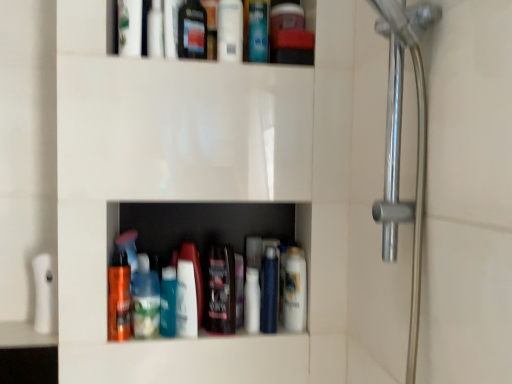
How much space does glossy plastic mouthwash at upper center, the third mouthwash when ordered from left to right, occupy horizontally?

2.19 inches.

The width and height of the screenshot is (512, 384). What are the coordinates of `green glossy mouthwash at upper center, which is counted as the third mouthwash, starting from the right` in the screenshot? It's located at (258, 31).

This screenshot has height=384, width=512. What do you see at coordinates (400, 144) in the screenshot? I see `silver metallic shower handle at right` at bounding box center [400, 144].

Find the location of a particular element. translucent plastic bottles at center is located at coordinates (204, 226).

What do you see at coordinates (204, 226) in the screenshot? I see `translucent plastic bottles at center` at bounding box center [204, 226].

Consider the image. What is the approximate width of white glossy lotion at center, which appears as the 1th toiletry when ordered from the bottom?

white glossy lotion at center, which appears as the 1th toiletry when ordered from the bottom, is 2.79 inches wide.

The width and height of the screenshot is (512, 384). I want to click on glossy plastic mouthwash at upper center, the third mouthwash when ordered from left to right, so click(x=192, y=30).

Which object is further away from the camera, white glossy lotion at center, which appears as the 1th toiletry when ordered from the bottom, or translucent plastic bottles at center?

translucent plastic bottles at center is further from the camera.

Is white glossy lotion at center, which appears as the 1th toiletry when ordered from the bottom, beside translucent plastic bottles at center?

No, white glossy lotion at center, which appears as the 1th toiletry when ordered from the bottom, is not touching translucent plastic bottles at center.

Can you confirm if white glossy lotion at center, the 2th toiletry viewed from the top, is bigger than translucent plastic bottles at center?

Actually, white glossy lotion at center, the 2th toiletry viewed from the top, might be smaller than translucent plastic bottles at center.

Between white glossy lotion at center, acting as the second toiletry starting from the left, and translucent plastic bottles at center, which one has more height?

translucent plastic bottles at center is taller.

Is white glossy mouthwash at upper center, which appears as the fifth mouthwash when viewed from the left, inside or outside of glossy plastic mouthwash at upper center, the third mouthwash when ordered from left to right?

The correct answer is: outside.

Between white glossy mouthwash at upper center, the fourth mouthwash in the right-to-left sequence, and glossy plastic mouthwash at upper center, which appears as the sixth mouthwash when viewed from the right, which one has larger width?

Wider between the two is white glossy mouthwash at upper center, the fourth mouthwash in the right-to-left sequence.

From the picture: Can you confirm if white glossy mouthwash at upper center, the fourth mouthwash in the right-to-left sequence, is smaller than glossy plastic mouthwash at upper center, which appears as the sixth mouthwash when viewed from the right?

Yes.

Is green glossy mouthwash at upper center, the 6th mouthwash when ordered from left to right, not close to glossy plastic mouthwash at upper center, the third mouthwash when ordered from left to right?

No, green glossy mouthwash at upper center, the 6th mouthwash when ordered from left to right, is not far away from glossy plastic mouthwash at upper center, the third mouthwash when ordered from left to right.

Is green glossy mouthwash at upper center, which is counted as the third mouthwash, starting from the right, not within glossy plastic mouthwash at upper center, which appears as the sixth mouthwash when viewed from the right?

Absolutely, green glossy mouthwash at upper center, which is counted as the third mouthwash, starting from the right, is external to glossy plastic mouthwash at upper center, which appears as the sixth mouthwash when viewed from the right.

From the glossy plastic mouthwash at upper center, which appears as the sixth mouthwash when viewed from the right, count 2nd mouthwashs backward and point to it. Please provide its 2D coordinates.

[(258, 31)]

Locate an element on the screen. The width and height of the screenshot is (512, 384). the 3rd mouthwash below the shiny black bottle at center, which ranks as the 4th mouthwash in left-to-right order (from a real-world perspective) is located at coordinates (119, 296).

Is point (212, 285) closer to camera compared to point (117, 259)?

Yes.

From a real-world perspective, is shiny black bottle at center, placed as the fifth mouthwash when sorted from right to left, physically located above or below shiny orange bottle at lower center, which is counted as the 1th mouthwash, starting from the left?

shiny black bottle at center, placed as the fifth mouthwash when sorted from right to left, is above shiny orange bottle at lower center, which is counted as the 1th mouthwash, starting from the left.

Is shiny black bottle at center, placed as the fifth mouthwash when sorted from right to left, not inside shiny orange bottle at lower center, which is counted as the 1th mouthwash, starting from the left?

shiny black bottle at center, placed as the fifth mouthwash when sorted from right to left, is positioned outside shiny orange bottle at lower center, which is counted as the 1th mouthwash, starting from the left.

Does silver metallic shower handle at right appear on the left side of glossy plastic mouthwash at upper center, the third mouthwash when ordered from left to right?

In fact, silver metallic shower handle at right is to the right of glossy plastic mouthwash at upper center, the third mouthwash when ordered from left to right.

Can you confirm if silver metallic shower handle at right is taller than glossy plastic mouthwash at upper center, the third mouthwash when ordered from left to right?

Yes.

Does point (397, 139) come farther from viewer compared to point (201, 14)?

No, it is in front of (201, 14).

From the image's perspective, who appears lower, glossy plastic mouthwash at upper center, the third mouthwash when ordered from left to right, or white glossy lotion at center, which is the first toiletry from right to left?

white glossy lotion at center, which is the first toiletry from right to left, appears lower in the image.

Is glossy plastic mouthwash at upper center, the third mouthwash when ordered from left to right, surrounding white glossy lotion at center, which is the first toiletry from right to left?

No, glossy plastic mouthwash at upper center, the third mouthwash when ordered from left to right, does not contain white glossy lotion at center, which is the first toiletry from right to left.

Identify the location of toiletry that is the 2nd one below the glossy plastic mouthwash at upper center, which appears as the sixth mouthwash when viewed from the right (from a real-world perspective). (189, 291).

Does glossy plastic mouthwash at upper center, which appears as the sixth mouthwash when viewed from the right, have a smaller size compared to white glossy lotion at center, acting as the second toiletry starting from the left?

No, glossy plastic mouthwash at upper center, which appears as the sixth mouthwash when viewed from the right, is not smaller than white glossy lotion at center, acting as the second toiletry starting from the left.

Which object is positioned more to the right, translucent plastic mouthwash at lower center, which appears as the 2th mouthwash when viewed from the left, or white glossy lotion at center, the 2th toiletry viewed from the top?

Positioned to the right is white glossy lotion at center, the 2th toiletry viewed from the top.

From the image's perspective, which one is positioned higher, translucent plastic mouthwash at lower center, which appears as the 2th mouthwash when viewed from the left, or white glossy lotion at center, the 2th toiletry viewed from the top?

white glossy lotion at center, the 2th toiletry viewed from the top, appears higher in the image.

Where is `mouthwash that is the 2nd object located below the white glossy lotion at center, which appears as the 1th toiletry when ordered from the bottom (from the image's perspective)`? This screenshot has width=512, height=384. mouthwash that is the 2nd object located below the white glossy lotion at center, which appears as the 1th toiletry when ordered from the bottom (from the image's perspective) is located at coordinates point(145,299).

Considering the relative sizes of translucent plastic mouthwash at lower center, which appears as the 2th mouthwash when viewed from the left, and white glossy lotion at center, which appears as the 1th toiletry when ordered from the bottom, in the image provided, is translucent plastic mouthwash at lower center, which appears as the 2th mouthwash when viewed from the left, shorter than white glossy lotion at center, which appears as the 1th toiletry when ordered from the bottom,?

Indeed, translucent plastic mouthwash at lower center, which appears as the 2th mouthwash when viewed from the left, has a lesser height compared to white glossy lotion at center, which appears as the 1th toiletry when ordered from the bottom.

Identify the location of shelf behind the white glossy lotion at center, the 2th toiletry viewed from the top. This screenshot has height=384, width=512. (204, 226).

From a real-world perspective, which mouthwash is the 1st one underneath the white glossy mouthwash at upper center, the fourth mouthwash in the right-to-left sequence? Please provide its 2D coordinates.

[(192, 30)]

When comparing their distances from shiny black bottle at center, which ranks as the 4th mouthwash in left-to-right order, does silver metallic shower handle at right or translucent plastic bottle at center seem closer?

Among the two, translucent plastic bottle at center is located nearer to shiny black bottle at center, which ranks as the 4th mouthwash in left-to-right order.

Considering their positions, is shiny black bottle at center, placed as the fifth mouthwash when sorted from right to left, positioned closer to translucent plastic mouthwash at lower center, the seventh mouthwash from the right, than white glossy mouthwash at center, which is counted as the eighth mouthwash, starting from the left?

The object closer to translucent plastic mouthwash at lower center, the seventh mouthwash from the right, is shiny black bottle at center, placed as the fifth mouthwash when sorted from right to left.

Considering their positions, is shiny orange bottle at lower center, which is counted as the 1th mouthwash, starting from the left, positioned closer to translucent plastic mouthwash at lower center, the seventh mouthwash from the right, than blue glossy mouthwash at center, positioned as the 7th mouthwash in left-to-right order?

shiny orange bottle at lower center, which is counted as the 1th mouthwash, starting from the left, is positioned closer to the anchor translucent plastic mouthwash at lower center, the seventh mouthwash from the right.

Looking at the image, which one is located further to translucent plastic mouthwash at lower center, which appears as the 2th mouthwash when viewed from the left, glossy plastic mouthwash at upper center, the third mouthwash when ordered from left to right, or shiny black bottle at center, which ranks as the 4th mouthwash in left-to-right order?

glossy plastic mouthwash at upper center, the third mouthwash when ordered from left to right, is further to translucent plastic mouthwash at lower center, which appears as the 2th mouthwash when viewed from the left.

Estimate the real-world distances between objects in this image. Which object is closer to blue glossy mouthwash at center, the 2th mouthwash viewed from the right, shiny black bottle at center, which ranks as the 4th mouthwash in left-to-right order, or translucent plastic bottle at center?

shiny black bottle at center, which ranks as the 4th mouthwash in left-to-right order, is positioned closer to the anchor blue glossy mouthwash at center, the 2th mouthwash viewed from the right.

Looking at the image, which one is located further to silver metallic shower handle at right, shiny orange bottle at lower center, which is counted as the 1th mouthwash, starting from the left, or translucent plastic bottles at center?

Among the two, shiny orange bottle at lower center, which is counted as the 1th mouthwash, starting from the left, is located further to silver metallic shower handle at right.

Based on their spatial positions, is translucent plastic bottle at center or transparent plastic bottle at upper center, which is the second toiletry from right to left, further from white glossy mouthwash at upper center, which appears as the fifth mouthwash when viewed from the left?

translucent plastic bottle at center lies further to white glossy mouthwash at upper center, which appears as the fifth mouthwash when viewed from the left, than the other object.

Considering their positions, is white glossy mouthwash at center, which is counted as the eighth mouthwash, starting from the left, positioned further to green glossy mouthwash at upper center, which is counted as the third mouthwash, starting from the right, than translucent plastic bottles at center?

white glossy mouthwash at center, which is counted as the eighth mouthwash, starting from the left, lies further to green glossy mouthwash at upper center, which is counted as the third mouthwash, starting from the right, than the other object.

Where is `bottle between translucent plastic mouthwash at lower center, which appears as the 2th mouthwash when viewed from the left, and blue glossy mouthwash at center, positioned as the 7th mouthwash in left-to-right order, in the horizontal direction`? Image resolution: width=512 pixels, height=384 pixels. bottle between translucent plastic mouthwash at lower center, which appears as the 2th mouthwash when viewed from the left, and blue glossy mouthwash at center, positioned as the 7th mouthwash in left-to-right order, in the horizontal direction is located at coordinates (168, 302).

In order to click on toiletry between glossy plastic mouthwash at upper center, the third mouthwash when ordered from left to right, and translucent plastic bottles at center vertically in this screenshot , I will do `click(155, 30)`.

The width and height of the screenshot is (512, 384). I want to click on toiletry between green glossy mouthwash at upper center, which is counted as the third mouthwash, starting from the right, and white glossy lotion at center, the 2th toiletry viewed from the top, from top to bottom, so (x=155, y=30).

The width and height of the screenshot is (512, 384). What are the coordinates of `shelf between glossy plastic mouthwash at upper center, which appears as the sixth mouthwash when viewed from the right, and white glossy lotion at center, which appears as the 1th toiletry when ordered from the bottom, from top to bottom` in the screenshot? It's located at (204, 226).